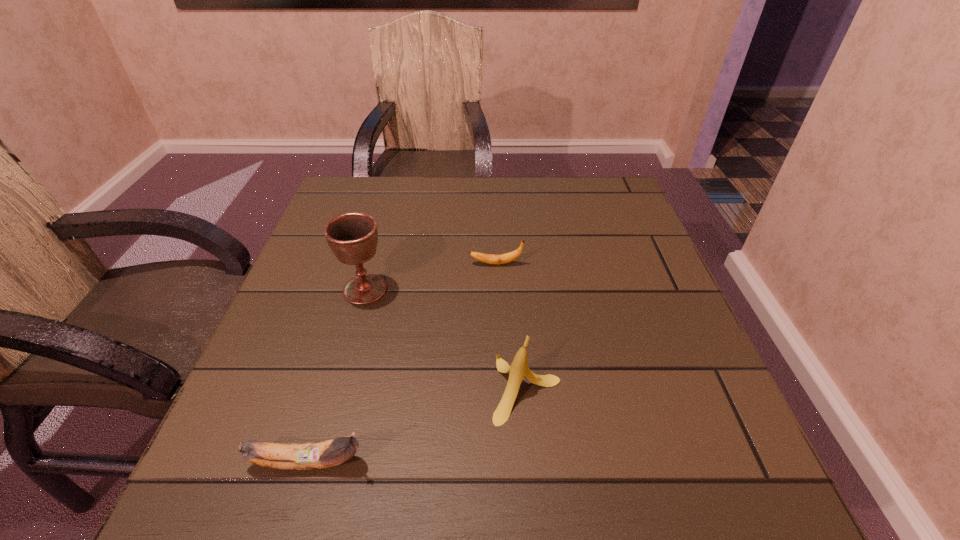
Identify the location of vacant area situated 0.070m on the peel of the farthest object from the top. (438, 264).

You are a GUI agent. You are given a task and a screenshot of the screen. Output one action in this format:
    pyautogui.click(x=<x>, y=<y>)
    Task: Click on the vacant area located 0.060m on the peel of the farthest object from the top
    The height and width of the screenshot is (540, 960).
    Given the screenshot: What is the action you would take?
    pyautogui.click(x=443, y=264)

Locate an element on the screen. The height and width of the screenshot is (540, 960). vacant space located 0.120m on the peel of the farthest object from the top is located at coordinates (416, 264).

I want to click on object at the near edge, so click(x=315, y=455).

Identify the location of chalice located at the left edge. This screenshot has height=540, width=960. (352, 237).

Locate an element on the screen. The image size is (960, 540). banana present at the left edge is located at coordinates (315, 455).

Identify the location of object situated at the near left corner. (315, 455).

In the image, there is a desktop. What are the coordinates of `free space at the far edge` in the screenshot? It's located at (478, 193).

Image resolution: width=960 pixels, height=540 pixels. What are the coordinates of `vacant space at the near edge` in the screenshot? It's located at (454, 503).

This screenshot has width=960, height=540. Identify the location of blank space at the left edge of the desktop. (351, 321).